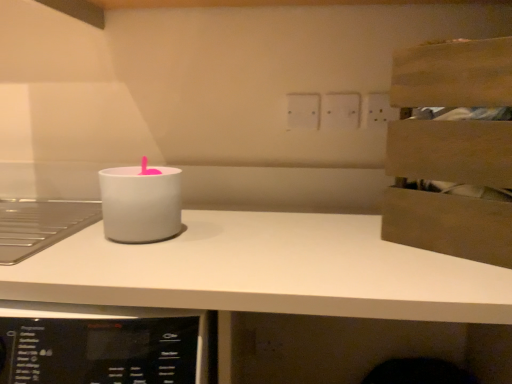
Question: Which direction should I rotate to look at white plastic electric outlet at upper center, the 2th electric outlet when ordered from left to right?

Choices:
 (A) left
 (B) right

Answer: (B)

Question: Is white matte countertop at center further to the viewer compared to white matte candle holder at center?

Choices:
 (A) yes
 (B) no

Answer: (B)

Question: Can you confirm if white matte countertop at center is thinner than white matte candle holder at center?

Choices:
 (A) no
 (B) yes

Answer: (A)

Question: Is white matte countertop at center outside white matte candle holder at center?

Choices:
 (A) no
 (B) yes

Answer: (B)

Question: Does white matte countertop at center come in front of white matte candle holder at center?

Choices:
 (A) yes
 (B) no

Answer: (A)

Question: Can white matte candle holder at center be found inside white matte countertop at center?

Choices:
 (A) yes
 (B) no

Answer: (B)

Question: Is white matte countertop at center wider than white matte candle holder at center?

Choices:
 (A) yes
 (B) no

Answer: (A)

Question: Is white matte candle holder at center far from white plastic electric outlet at upper center, positioned as the 1th electric outlet in left-to-right order?

Choices:
 (A) yes
 (B) no

Answer: (B)

Question: Does white matte candle holder at center have a smaller size compared to white plastic electric outlet at upper center, positioned as the 1th electric outlet in left-to-right order?

Choices:
 (A) yes
 (B) no

Answer: (B)

Question: Does white matte candle holder at center come in front of white plastic electric outlet at upper center, positioned as the 1th electric outlet in left-to-right order?

Choices:
 (A) yes
 (B) no

Answer: (A)

Question: Is white matte candle holder at center at the left side of white plastic electric outlet at upper center, positioned as the 1th electric outlet in left-to-right order?

Choices:
 (A) no
 (B) yes

Answer: (B)

Question: From a real-world perspective, is white matte candle holder at center located higher than white plastic electric outlet at upper center, which appears as the second electric outlet when viewed from the right?

Choices:
 (A) no
 (B) yes

Answer: (A)

Question: Can you confirm if white matte candle holder at center is shorter than white plastic electric outlet at upper center, which appears as the second electric outlet when viewed from the right?

Choices:
 (A) no
 (B) yes

Answer: (A)

Question: From the image's perspective, would you say white matte candle holder at center is positioned over wooden crate at upper right?

Choices:
 (A) no
 (B) yes

Answer: (A)